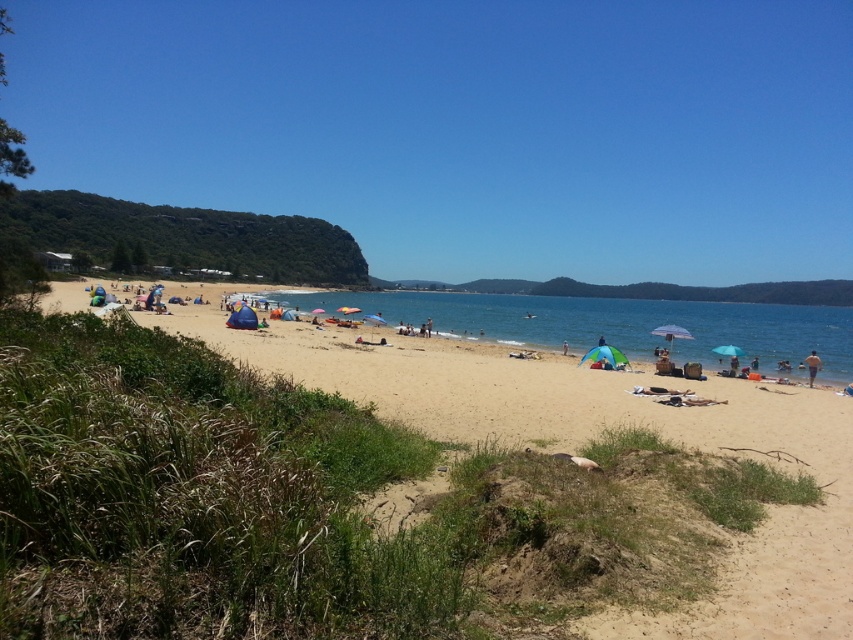
You are standing on the beach and looking at the scene. There is a point marked at coordinates point (465, 128). What is the color and object at that point?

The point (465, 128) indicates transparent blue sky at upper center.

You are planning to take a photo of the beach scene. You want to ensure that both the transparent blue sky at upper center and the blue fabric umbrella at center are clearly visible in your shot. Based on their sizes, which one should you focus on to ensure they both fit well in the frame?

The transparent blue sky at upper center might be wider than the blue fabric umbrella at center, so focusing on the wider sky area would help both elements fit well in the frame.

You are standing on the beach and want to reach the clear blue water at center to swim. There is a blue fabric umbrella at center in your way. Can you walk directly to the water without going around the umbrella?

The clear blue water at center is in front of the blue fabric umbrella at center, meaning the umbrella is between you and the water. Therefore, you cannot walk directly to the water without moving the umbrella or going around it.